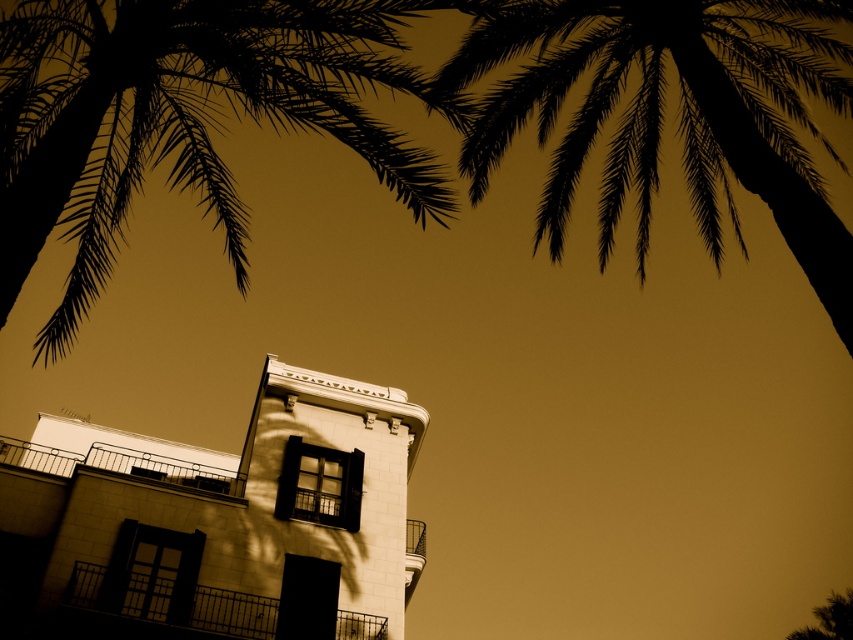
You are standing in front of the building and notice the silhouette leafy palm at upper left. Based on its position, can you determine if it is closer to the upper edge or the left edge of the image?

The silhouette leafy palm at upper left is located at point coordinates approximately 0.184 on the x axis and 0.219 on the y axis. Since both coordinates are relatively low, it is closer to both the upper and left edges of the image, but since the x coordinate is slightly lower than the y coordinate, it is marginally closer to the left edge than the upper edge.

You are an architect analyzing the composition of this image. You observe the silhouette leafy palm at upper left and the black silhouette palm tree at upper right. Which of these two palms appears shorter in the scene?

The silhouette leafy palm at upper left appears shorter than the black silhouette palm tree at upper right.

You are a drone operator tasked with capturing aerial footage of the building. Your drone is currently positioned between the silhouette leafy palm at upper left and the black silhouette palm tree at upper right. To ensure the building is fully visible in the shot, you need to determine if the distance between these two palms is sufficient for your drone to capture the entire structure. The building is 45 meters wide. Can the drone capture the entire building within the space between the two palms?

The distance between the silhouette leafy palm at upper left and the black silhouette palm tree at upper right is 46.47 meters, which is greater than the building width of 45 meters. Therefore, the drone can capture the entire building within the space between the two palms.